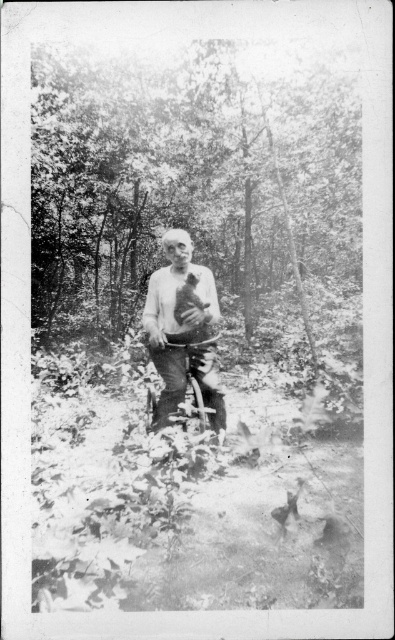
Is smooth bark tree at center above smooth white shirt at center?

Correct, smooth bark tree at center is located above smooth white shirt at center.

Does smooth bark tree at center appear on the right side of smooth white shirt at center?

Yes, smooth bark tree at center is to the right of smooth white shirt at center.

Identify the location of smooth bark tree at center. Image resolution: width=395 pixels, height=640 pixels. (191, 186).